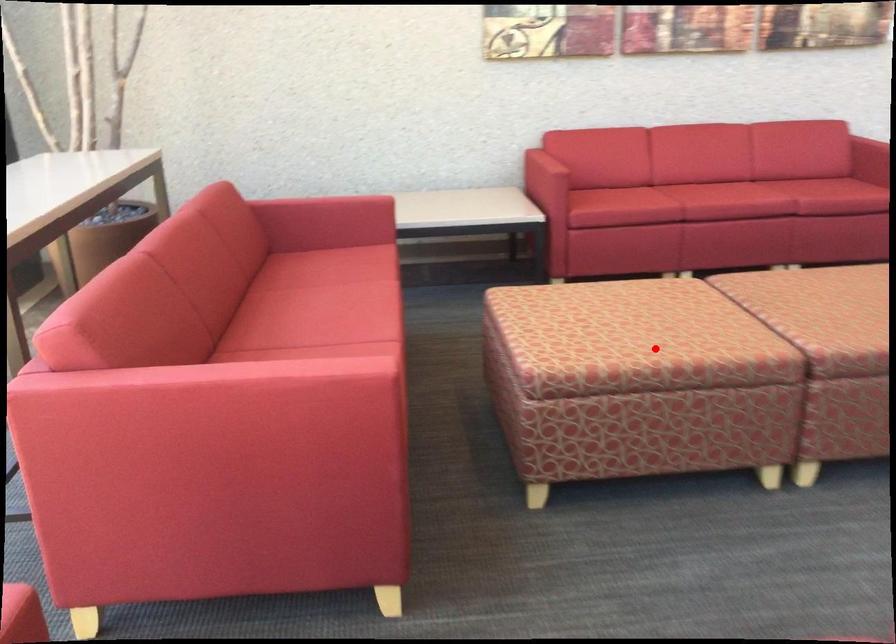
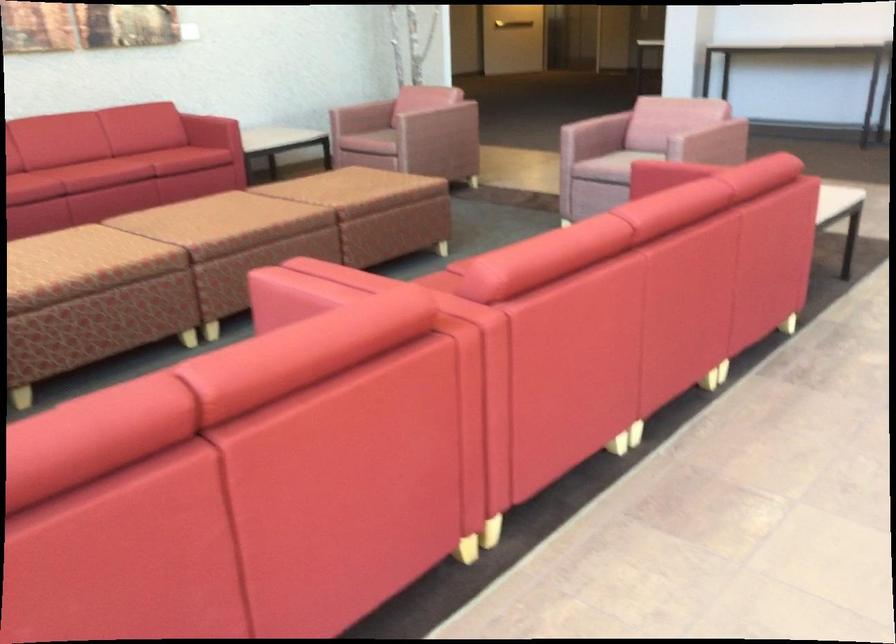
Locate, in the second image, the point that corresponds to the highlighted location in the first image.

(83, 265)